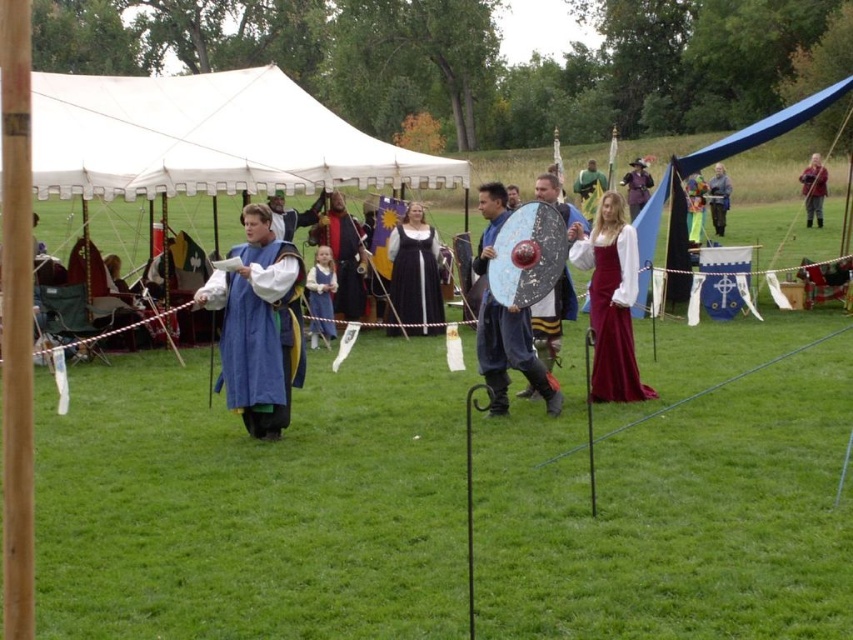
You are a photographer at the medieval festival. You want to take a group photo of the blue woolen robe at center and the velvet burgundy dress at center. The camera you have can capture a maximum width of 2.5 meters. Will both subjects fit in the frame?

The blue woolen robe at center and velvet burgundy dress at center are 2.77 meters apart. Since the camera can only capture up to 2.5 meters, they are too far apart to fit within the frame.

You are a participant in the medieval reenactment and need to move from the starting point at point [234,77] to the destination at point [817,156]. Which direction should you move to reach the destination?

To move from the starting point at point [234,77] to the destination at point [817,156], you should move downward and to the right since point [234,77] is in front of point [817,156].